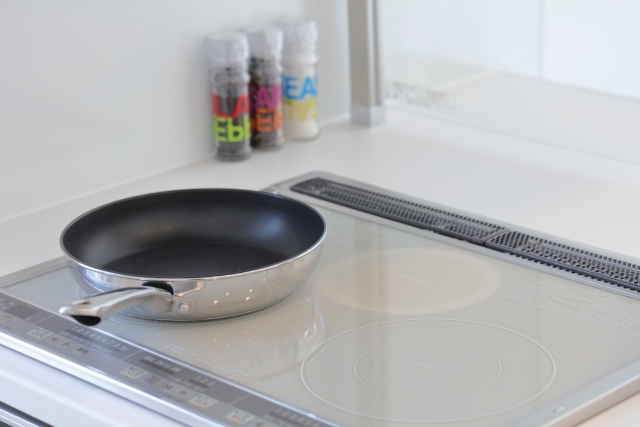
Image resolution: width=640 pixels, height=427 pixels. I want to click on empty burners, so click(445, 373), click(408, 286).